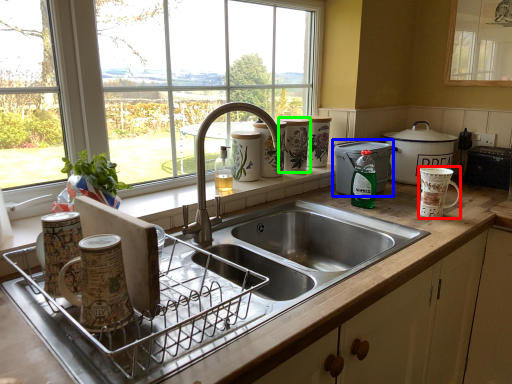
Question: Which object is the closest to the mug (highlighted by a red box)? Choose among these: appliance (highlighted by a blue box) or appliance (highlighted by a green box).

Choices:
 (A) appliance
 (B) appliance

Answer: (A)